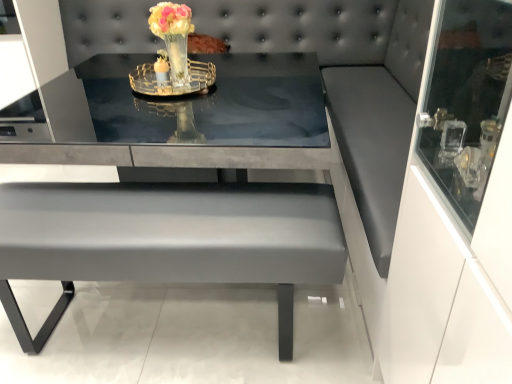
This screenshot has height=384, width=512. Describe the element at coordinates (170, 20) in the screenshot. I see `translucent glass vase at center` at that location.

I want to click on translucent glass vase at center, so click(x=170, y=20).

Describe the element at coordinates (181, 190) in the screenshot. I see `matte gray table at center` at that location.

Image resolution: width=512 pixels, height=384 pixels. Find the location of `matte gray table at center`. matte gray table at center is located at coordinates point(181,190).

Identify the location of translucent glass vase at center. (170, 20).

Can you confirm if matte gray table at center is positioned to the left of translucent glass vase at center?

In fact, matte gray table at center is to the right of translucent glass vase at center.

Which object is more forward, matte gray table at center or translucent glass vase at center?

matte gray table at center is in front.

Considering the positions of points (185, 268) and (164, 12), is point (185, 268) closer to camera compared to point (164, 12)?

Yes, it is.

From the image's perspective, which is above, matte gray table at center or translucent glass vase at center?

From the image's view, translucent glass vase at center is above.

From a real-world perspective, is matte gray table at center beneath translucent glass vase at center?

Indeed, from a real-world perspective, matte gray table at center is positioned beneath translucent glass vase at center.

Which object is thinner, matte gray table at center or translucent glass vase at center?

translucent glass vase at center is thinner.

Who is shorter, matte gray table at center or translucent glass vase at center?

translucent glass vase at center is shorter.

Is matte gray table at center smaller than translucent glass vase at center?

No, matte gray table at center is not smaller than translucent glass vase at center.

Based on the photo, would you say translucent glass vase at center is part of matte gray table at center's contents?

No, translucent glass vase at center is not inside matte gray table at center.

Is matte gray table at center not close to translucent glass vase at center?

No, matte gray table at center is in close proximity to translucent glass vase at center.

Is matte gray table at center facing towards translucent glass vase at center?

No, matte gray table at center does not turn towards translucent glass vase at center.

How far apart are matte gray table at center and translucent glass vase at center?

matte gray table at center is 50.35 centimeters away from translucent glass vase at center.

Where is `table on the right side of translucent glass vase at center`? The width and height of the screenshot is (512, 384). table on the right side of translucent glass vase at center is located at coordinates (181, 190).

Is translucent glass vase at center to the left of matte gray table at center from the viewer's perspective?

Correct, you'll find translucent glass vase at center to the left of matte gray table at center.

Is translucent glass vase at center closer to camera compared to matte gray table at center?

No, it is behind matte gray table at center.

Between point (185, 26) and point (48, 147), which one is positioned behind?

Positioned behind is point (185, 26).

In the scene shown: From the image's perspective, between translucent glass vase at center and matte gray table at center, who is located below?

matte gray table at center.

From a real-world perspective, is translucent glass vase at center physically located above or below matte gray table at center?

translucent glass vase at center is situated higher than matte gray table at center in the real world.

Which object is thinner, translucent glass vase at center or matte gray table at center?

translucent glass vase at center.

Does translucent glass vase at center have a greater height compared to matte gray table at center?

No, translucent glass vase at center is not taller than matte gray table at center.

Which of these two, translucent glass vase at center or matte gray table at center, is bigger?

With larger size is matte gray table at center.

Is matte gray table at center surrounded by translucent glass vase at center?

Definitely not — matte gray table at center is not inside translucent glass vase at center.

Is translucent glass vase at center directly adjacent to matte gray table at center?

No, translucent glass vase at center is not beside matte gray table at center.

Could you tell me if translucent glass vase at center is turned towards matte gray table at center?

No, translucent glass vase at center is not oriented towards matte gray table at center.

Find the location of a particular element. This screenshot has height=384, width=512. table below the translucent glass vase at center (from the image's perspective) is located at coordinates (181, 190).

Locate an element on the screen. The width and height of the screenshot is (512, 384). table on the right of the translucent glass vase at center is located at coordinates (181, 190).

Locate an element on the screen. table directly beneath the translucent glass vase at center (from a real-world perspective) is located at coordinates (181, 190).